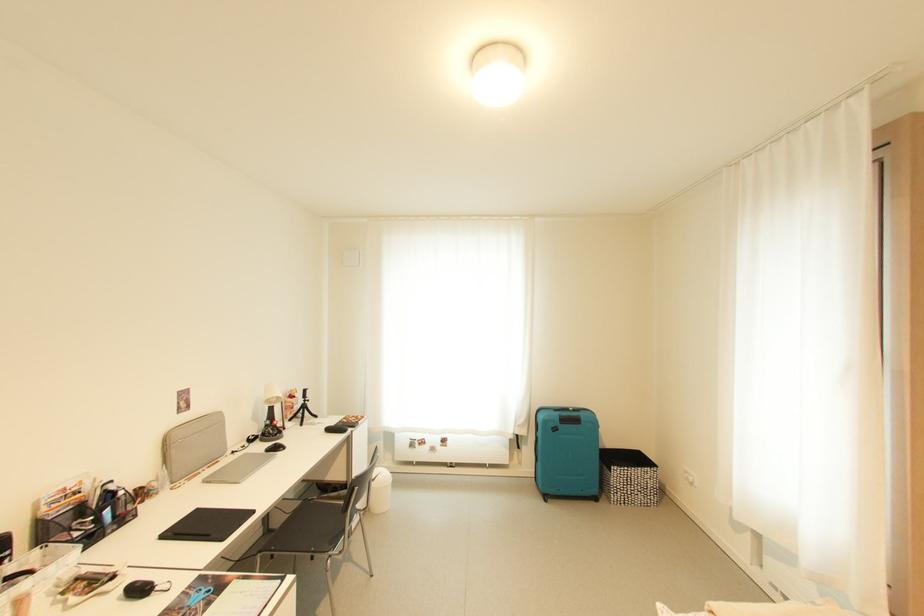
What do you see at coordinates (199, 594) in the screenshot?
I see `a blue scissors` at bounding box center [199, 594].